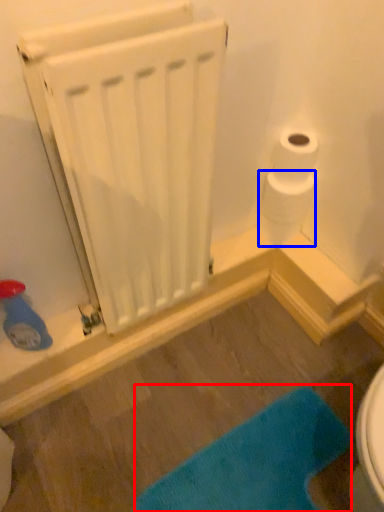
Question: Which of the following is the farthest to the observer, bath mat (highlighted by a red box) or toilet paper (highlighted by a blue box)?

Choices:
 (A) bath mat
 (B) toilet paper

Answer: (B)